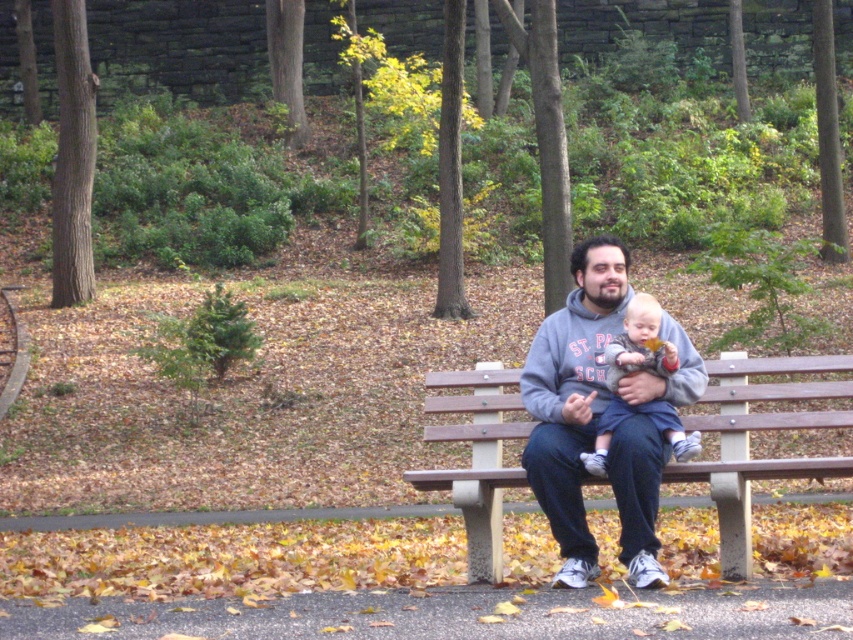
What do you see at coordinates (585, 394) in the screenshot?
I see `matte gray hoodie at center` at bounding box center [585, 394].

Which of these two, matte gray hoodie at center or blue denim pants at center, stands taller?

matte gray hoodie at center

Identify the location of matte gray hoodie at center. This screenshot has width=853, height=640. (585, 394).

Is wooden bench at center in front of blue denim pants at center?

No, it is not.

Looking at this image, between wooden bench at center and blue denim pants at center, which one is positioned lower?

wooden bench at center is below.

Is point (735, 467) in front of point (680, 452)?

No, (735, 467) is further to viewer.

Where is `wooden bench at center`? The height and width of the screenshot is (640, 853). wooden bench at center is located at coordinates (758, 429).

Is matte gray hoodie at center closer to camera compared to wooden bench at center?

Yes, matte gray hoodie at center is in front of wooden bench at center.

Can you confirm if matte gray hoodie at center is positioned below wooden bench at center?

Incorrect, matte gray hoodie at center is not positioned below wooden bench at center.

Between point (646, 490) and point (808, 394), which one is positioned behind?

Positioned behind is point (808, 394).

Locate an element on the screen. matte gray hoodie at center is located at coordinates (585, 394).